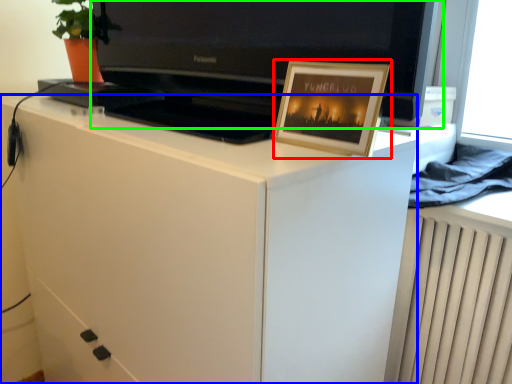
Question: Which object is the closest to the picture frame (highlighted by a red box)? Choose among these: cabinetry (highlighted by a blue box) or television (highlighted by a green box).

Choices:
 (A) cabinetry
 (B) television

Answer: (A)